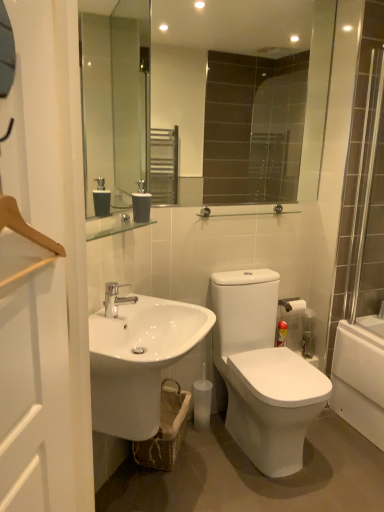
Question: From a real-world perspective, is white glossy sink at lower left beneath white wooden screen door at left?

Choices:
 (A) no
 (B) yes

Answer: (B)

Question: Is white glossy sink at lower left thinner than white wooden screen door at left?

Choices:
 (A) yes
 (B) no

Answer: (B)

Question: Is white glossy sink at lower left positioned far away from white wooden screen door at left?

Choices:
 (A) yes
 (B) no

Answer: (B)

Question: Can you confirm if white glossy sink at lower left is wider than white wooden screen door at left?

Choices:
 (A) no
 (B) yes

Answer: (B)

Question: Considering the relative positions of white glossy sink at lower left and white wooden screen door at left in the image provided, is white glossy sink at lower left behind white wooden screen door at left?

Choices:
 (A) no
 (B) yes

Answer: (B)

Question: Is white glossy sink at lower left at the right side of white wooden screen door at left?

Choices:
 (A) yes
 (B) no

Answer: (A)

Question: Is glossy glass mirror at upper center oriented towards white wooden screen door at left?

Choices:
 (A) yes
 (B) no

Answer: (B)

Question: From the image's perspective, is glossy glass mirror at upper center located beneath white wooden screen door at left?

Choices:
 (A) yes
 (B) no

Answer: (B)

Question: Can you confirm if glossy glass mirror at upper center is smaller than white wooden screen door at left?

Choices:
 (A) no
 (B) yes

Answer: (A)

Question: Considering the relative positions of glossy glass mirror at upper center and white wooden screen door at left in the image provided, is glossy glass mirror at upper center in front of white wooden screen door at left?

Choices:
 (A) no
 (B) yes

Answer: (A)

Question: From a real-world perspective, is glossy glass mirror at upper center on top of white wooden screen door at left?

Choices:
 (A) yes
 (B) no

Answer: (A)

Question: Is glossy glass mirror at upper center positioned beyond the bounds of white wooden screen door at left?

Choices:
 (A) no
 (B) yes

Answer: (B)

Question: Can white matte toilet paper at right be found inside clear glass rail at upper center?

Choices:
 (A) no
 (B) yes

Answer: (A)